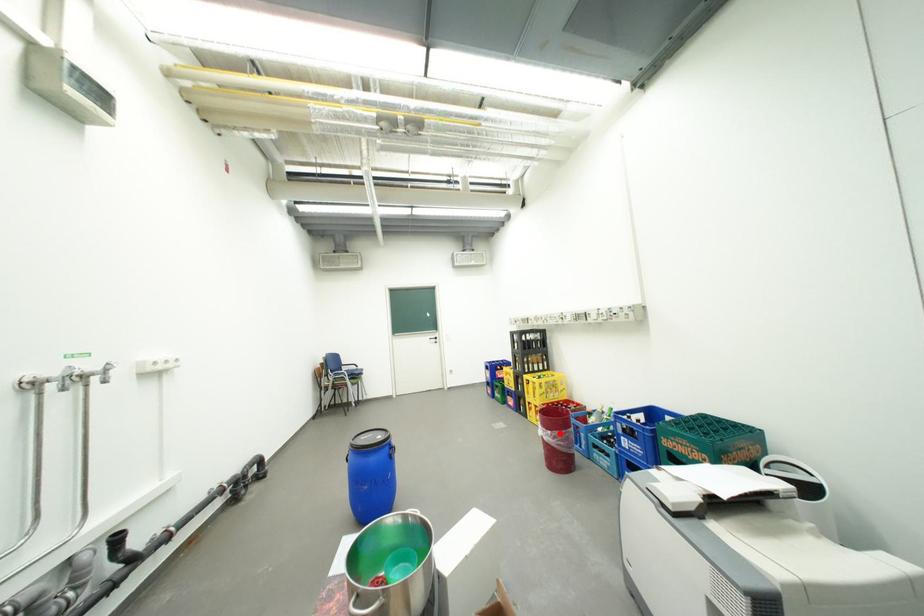
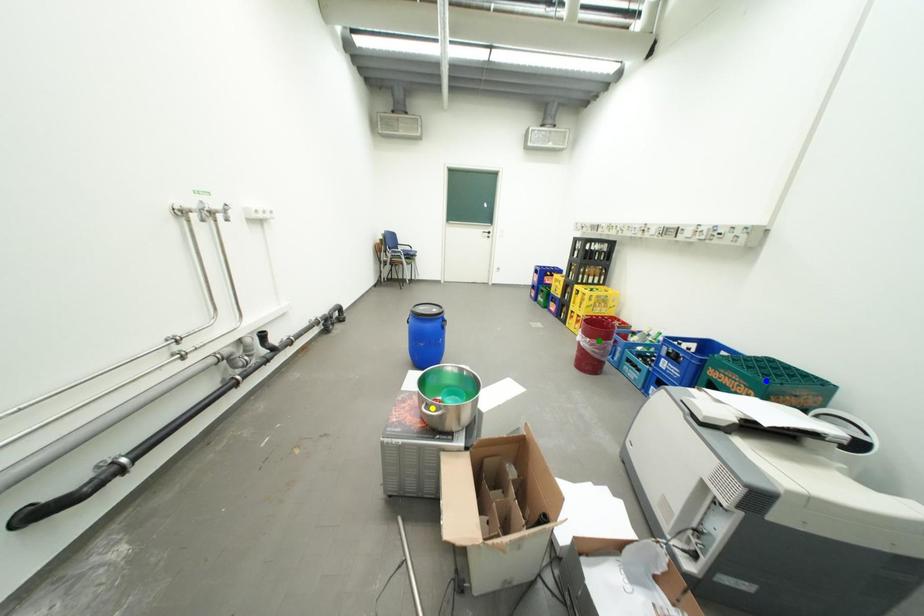
Question: I am providing you with two images of the same scene from different viewpoints. A red point is marked on the first image. You are given multiple points on the second image. In image 2, which mark is for the same physical point as the one in image 1?

Choices:
 (A) blue point
 (B) green point
 (C) yellow point

Answer: (B)